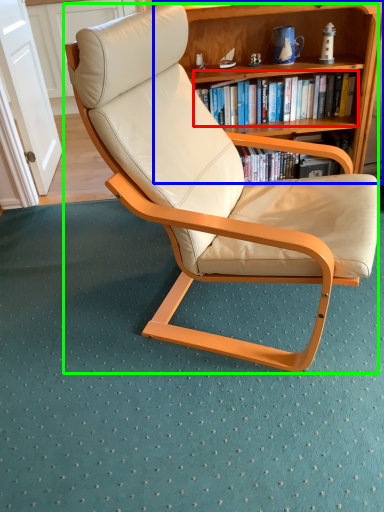
Question: Based on their relative distances, which object is farther from book (highlighted by a red box)? Choose from bookcase (highlighted by a blue box) and chair (highlighted by a green box).

Choices:
 (A) bookcase
 (B) chair

Answer: (B)